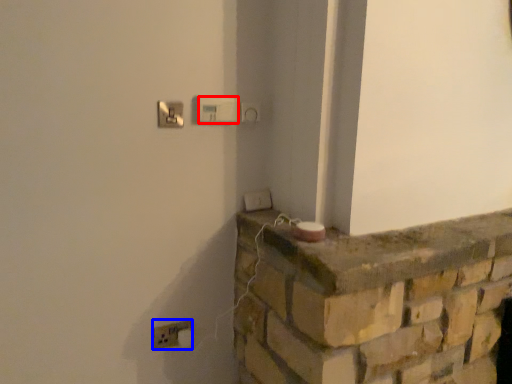
Question: Among these objects, which one is nearest to the camera, light switch (highlighted by a red box) or electric outlet (highlighted by a blue box)?

Choices:
 (A) light switch
 (B) electric outlet

Answer: (A)